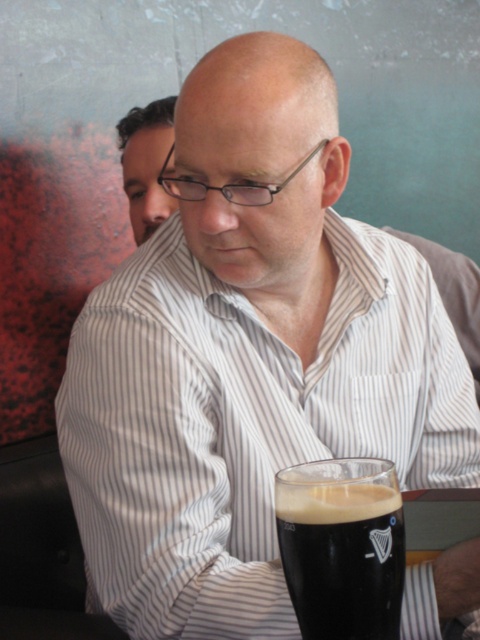
Question: Which point appears farthest from the camera in this image?

Choices:
 (A) (385, 577)
 (B) (132, 170)

Answer: (B)

Question: Considering the relative positions of dark brown glass at lower center and matte black hair at upper left in the image provided, where is dark brown glass at lower center located with respect to matte black hair at upper left?

Choices:
 (A) left
 (B) right

Answer: (B)

Question: Does dark brown glass at lower center come in front of matte black hair at upper left?

Choices:
 (A) yes
 (B) no

Answer: (A)

Question: Does dark brown glass at lower center have a lesser width compared to matte black hair at upper left?

Choices:
 (A) yes
 (B) no

Answer: (A)